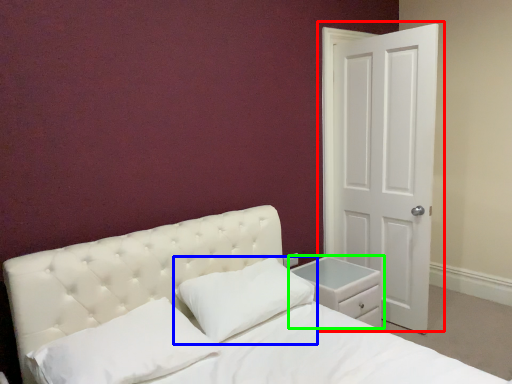
Question: Considering the real-world distances, which object is farthest from door (highlighted by a red box)? pillow (highlighted by a blue box) or nightstand (highlighted by a green box)?

Choices:
 (A) pillow
 (B) nightstand

Answer: (A)